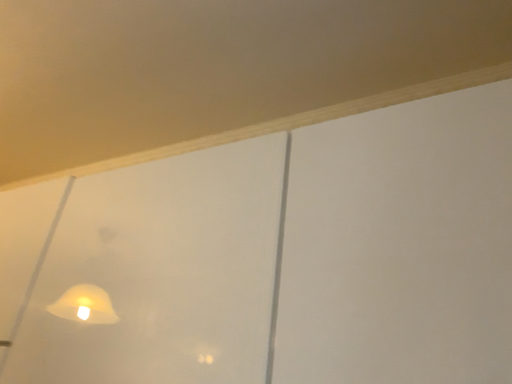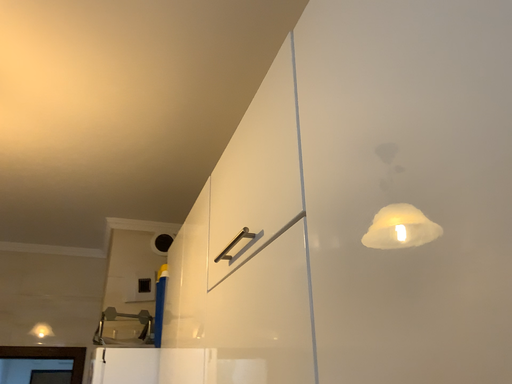
Question: How did the camera likely rotate when shooting the video?

Choices:
 (A) rotated upward
 (B) rotated downward

Answer: (B)